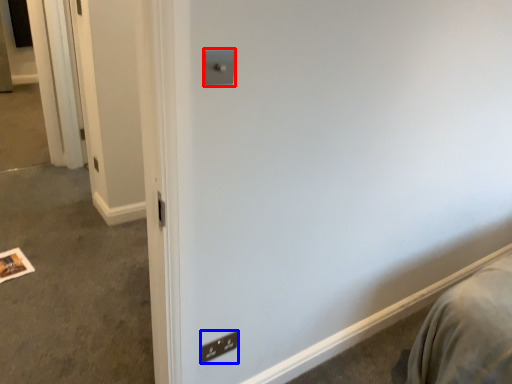
Question: Which object appears farthest to the camera in this image, light switch (highlighted by a red box) or light switch (highlighted by a blue box)?

Choices:
 (A) light switch
 (B) light switch

Answer: (B)